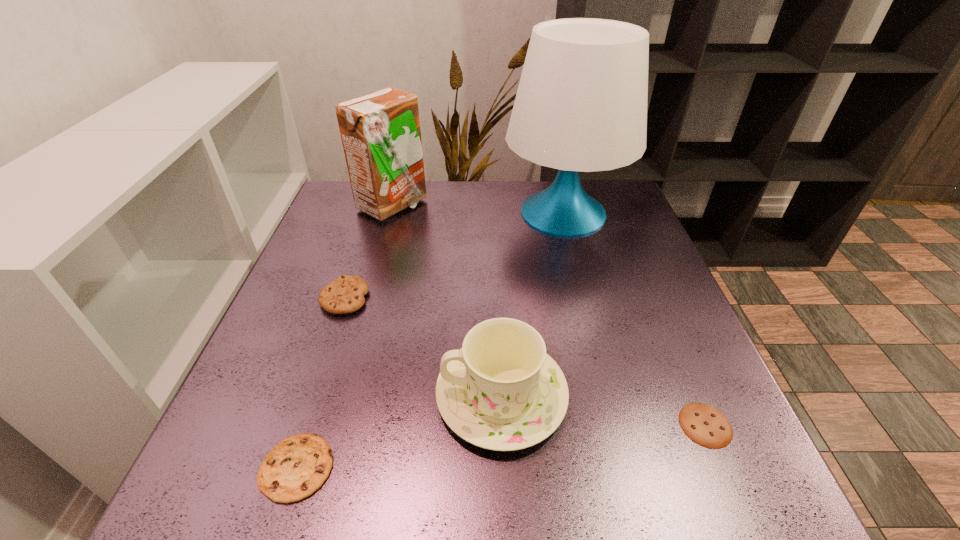
Locate an element on the screen. The height and width of the screenshot is (540, 960). object that is the fourth nearest to the farthest cookie is located at coordinates (581, 105).

Point out which object is positioned as the fourth nearest to the fourth shortest object. Please provide its 2D coordinates. Your answer should be formatted as a tuple, i.e. [(x, y)], where the tuple contains the x and y coordinates of a point satisfying the conditions above.

[(581, 105)]

The height and width of the screenshot is (540, 960). I want to click on cookie that is the closest to the second shortest object, so click(345, 294).

At what (x,y) coordinates should I click in order to perform the action: click on the closest cookie relative to the third tallest object. Please return your answer as a coordinate pair (x, y). Looking at the image, I should click on (295, 468).

Where is `free region that satisfies the following two spatial constraints: 1. on the front-facing side of the shortest object; 2. on the right side of the table lamp`? free region that satisfies the following two spatial constraints: 1. on the front-facing side of the shortest object; 2. on the right side of the table lamp is located at coordinates (620, 425).

The height and width of the screenshot is (540, 960). Find the location of `vacant space that satisfies the following two spatial constraints: 1. on the straw side of the fifth shortest object; 2. on the back side of the shortest object`. vacant space that satisfies the following two spatial constraints: 1. on the straw side of the fifth shortest object; 2. on the back side of the shortest object is located at coordinates [330, 425].

Locate an element on the screen. vacant space that satisfies the following two spatial constraints: 1. on the front side of the rightmost cookie; 2. on the right side of the third farthest object is located at coordinates (302, 425).

This screenshot has width=960, height=540. What are the coordinates of `free space that satisfies the following two spatial constraints: 1. on the front-facing side of the shortest cookie; 2. on the right side of the table lamp` in the screenshot? It's located at (620, 425).